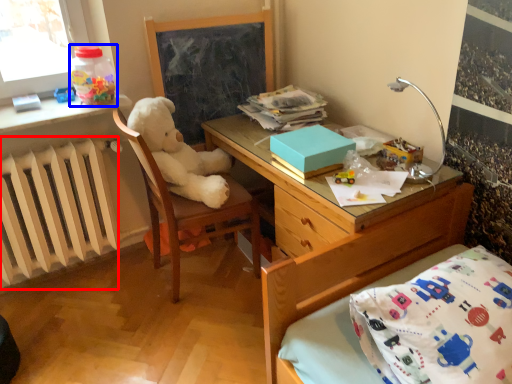
Question: Among these objects, which one is farthest to the camera, radiator (highlighted by a red box) or bottle (highlighted by a blue box)?

Choices:
 (A) radiator
 (B) bottle

Answer: (B)